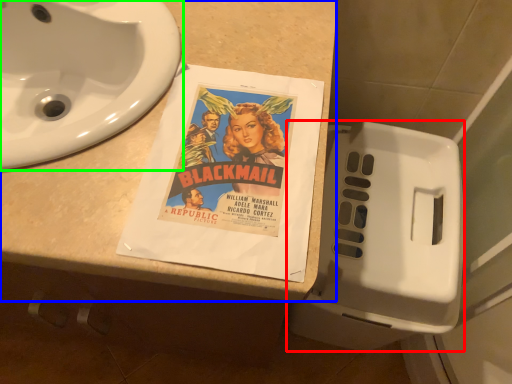
Question: Which object is the farthest from toilet (highlighted by a red box)? Choose among these: counter top (highlighted by a blue box) or sink (highlighted by a green box).

Choices:
 (A) counter top
 (B) sink

Answer: (B)